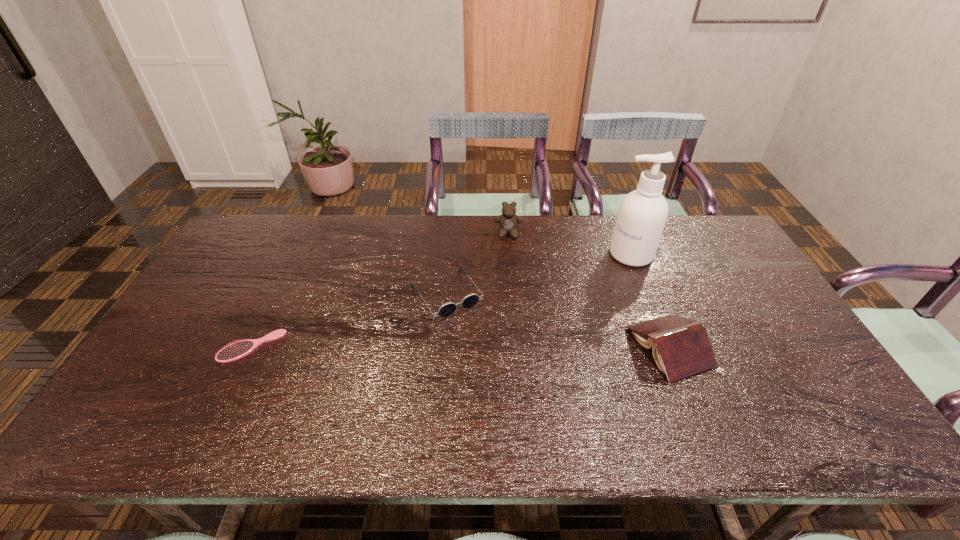
Locate an element on the screen. The width and height of the screenshot is (960, 540). cleansing agent that is at the far edge is located at coordinates (642, 215).

The width and height of the screenshot is (960, 540). I want to click on teddy bear present at the far edge, so click(x=508, y=221).

Find the location of a particular element. This screenshot has height=540, width=960. object situated at the near edge is located at coordinates [x=680, y=346].

Where is `vacant space at the far edge of the desktop`? Image resolution: width=960 pixels, height=540 pixels. vacant space at the far edge of the desktop is located at coordinates (490, 241).

Find the location of a particular element. vacant space at the near edge of the desktop is located at coordinates (515, 405).

In order to click on vacant space at the left edge of the desktop in this screenshot , I will do `click(252, 280)`.

Identify the location of vacant space at the right edge of the desktop. (735, 314).

Find the location of a particular element. vacant space at the far left corner of the desktop is located at coordinates (235, 232).

This screenshot has height=540, width=960. In the image, there is a desktop. Find the location of `vacant space at the far right corner`. vacant space at the far right corner is located at coordinates (693, 225).

This screenshot has width=960, height=540. Find the location of `unoccupied area between the teddy bear and the cleansing agent`. unoccupied area between the teddy bear and the cleansing agent is located at coordinates (569, 244).